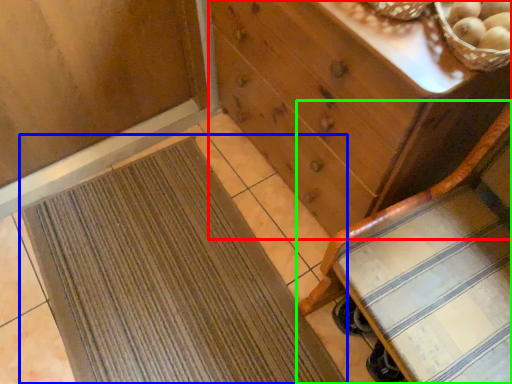
Question: Estimate the real-world distances between objects in this image. Which object is closer to chest of drawers (highlighted by a red box), mat (highlighted by a blue box) or furniture (highlighted by a green box)?

Choices:
 (A) mat
 (B) furniture

Answer: (B)